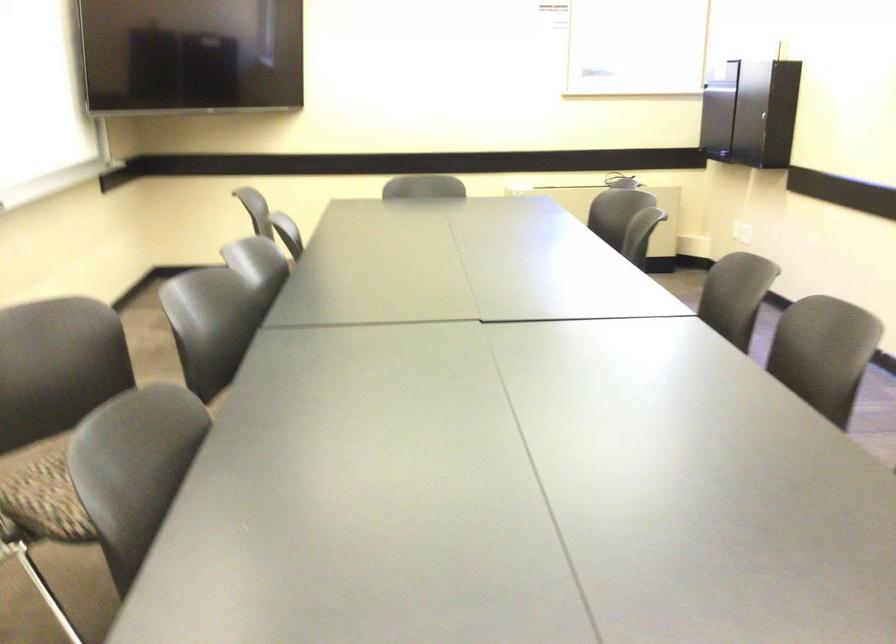
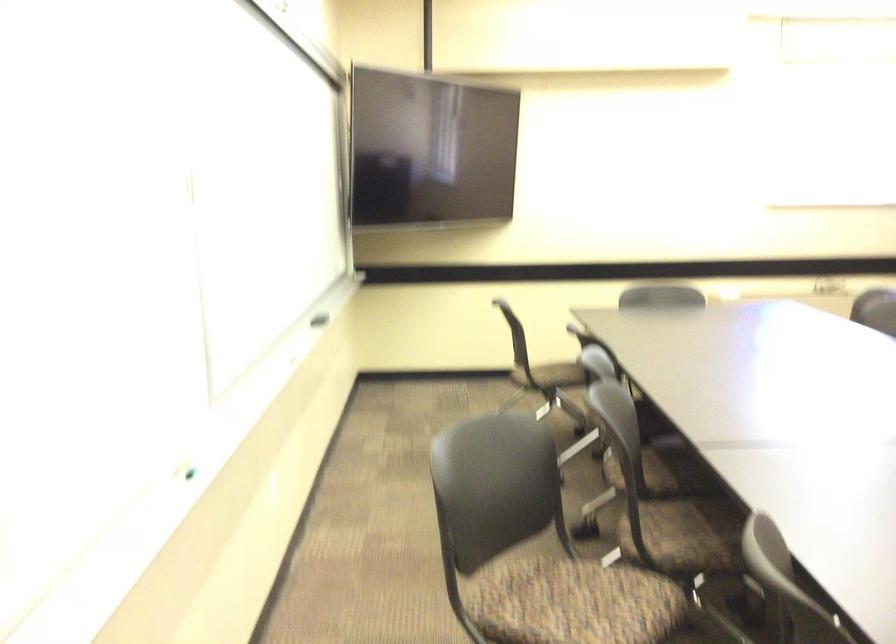
Question: The first image is from the beginning of the video and the second image is from the end. How did the camera likely rotate when shooting the video?

Choices:
 (A) Left
 (B) Right
 (C) Up
 (D) Down

Answer: (C)